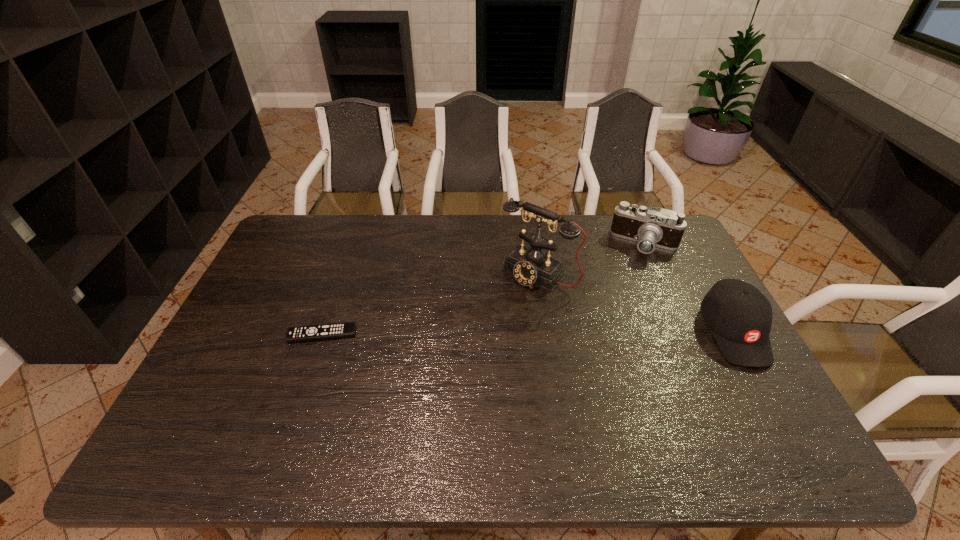
Locate an element on the screen. The image size is (960, 540). vacant area that lies between the shortest object and the camera is located at coordinates (484, 289).

Where is `free space that is in between the telephone and the shortest object`? The image size is (960, 540). free space that is in between the telephone and the shortest object is located at coordinates (430, 304).

Locate an element on the screen. The height and width of the screenshot is (540, 960). free space between the leftmost object and the baseball cap is located at coordinates (528, 333).

Locate which object is the closest to the baseball cap. Please provide its 2D coordinates. Your answer should be formatted as a tuple, i.e. [(x, y)], where the tuple contains the x and y coordinates of a point satisfying the conditions above.

[(651, 227)]

Locate which object ranks third in proximity to the remote control. Please provide its 2D coordinates. Your answer should be formatted as a tuple, i.e. [(x, y)], where the tuple contains the x and y coordinates of a point satisfying the conditions above.

[(739, 316)]

This screenshot has height=540, width=960. Find the location of `vacant space that satisfies the following two spatial constraints: 1. on the back side of the camera; 2. on the right side of the tallest object`. vacant space that satisfies the following two spatial constraints: 1. on the back side of the camera; 2. on the right side of the tallest object is located at coordinates (534, 244).

Locate an element on the screen. The width and height of the screenshot is (960, 540). free space that satisfies the following two spatial constraints: 1. on the back side of the shortest object; 2. on the left side of the tallest object is located at coordinates (344, 274).

I want to click on vacant space that satisfies the following two spatial constraints: 1. on the back side of the shortest object; 2. on the right side of the telephone, so click(x=344, y=274).